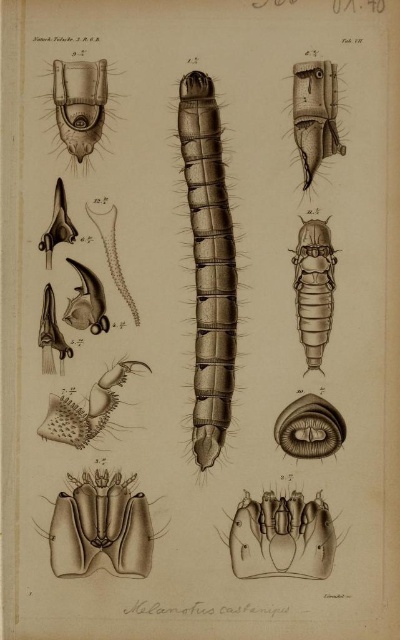
Question: Based on their relative distances, which object is farther from the brown textured caterpillar at center?

Choices:
 (A) brown matte insect at center
 (B) matte black insect at upper left

Answer: (B)

Question: In this image, where is brown textured caterpillar at center located relative to brown matte insect at center?

Choices:
 (A) below
 (B) above

Answer: (B)

Question: Which of the following is the farthest from the observer?

Choices:
 (A) matte black insect at upper left
 (B) brown textured insect at upper right
 (C) brown matte insect at center
 (D) brown textured caterpillar at center

Answer: (C)

Question: Does brown textured caterpillar at center have a greater width compared to brown textured insect at upper right?

Choices:
 (A) no
 (B) yes

Answer: (B)

Question: Does brown textured caterpillar at center have a smaller size compared to brown matte insect at center?

Choices:
 (A) yes
 (B) no

Answer: (B)

Question: Which of the following is the closest to the observer?

Choices:
 (A) (331, 90)
 (B) (202, 220)
 (C) (94, 99)

Answer: (C)